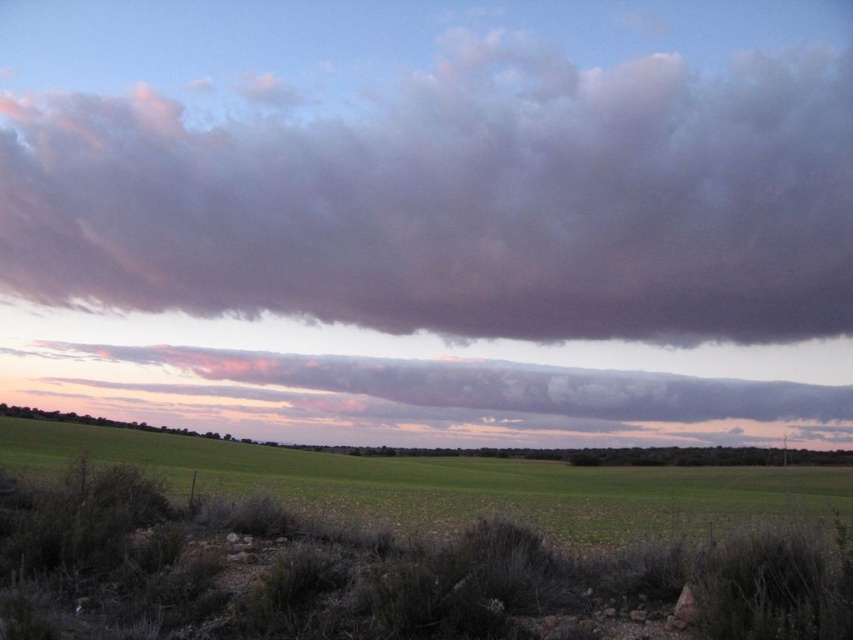
Can you confirm if dark gray cloud at upper center is smaller than green grass at lower center?

No, dark gray cloud at upper center is not smaller than green grass at lower center.

Which is above, dark gray cloud at upper center or green grass at lower center?

Positioned higher is dark gray cloud at upper center.

Is point (552, 262) positioned behind point (364, 508)?

Yes, point (552, 262) is farther from viewer.

I want to click on dark gray cloud at upper center, so click(x=459, y=202).

Does dark gray cloud at upper center have a smaller size compared to cloudy gray cloud at upper center?

No.

Is dark gray cloud at upper center above cloudy gray cloud at upper center?

Yes.

This screenshot has height=640, width=853. Describe the element at coordinates (459, 202) in the screenshot. I see `dark gray cloud at upper center` at that location.

What are the coordinates of `dark gray cloud at upper center` in the screenshot? It's located at (459, 202).

Between green grass at lower center and cloudy gray cloud at upper center, which one is positioned lower?

cloudy gray cloud at upper center

Does point (216, 522) lie in front of point (65, 346)?

Yes, point (216, 522) is in front of point (65, 346).

Is point (654, 580) positioned after point (32, 385)?

That is False.

Where is `green grass at lower center`? green grass at lower center is located at coordinates (404, 545).